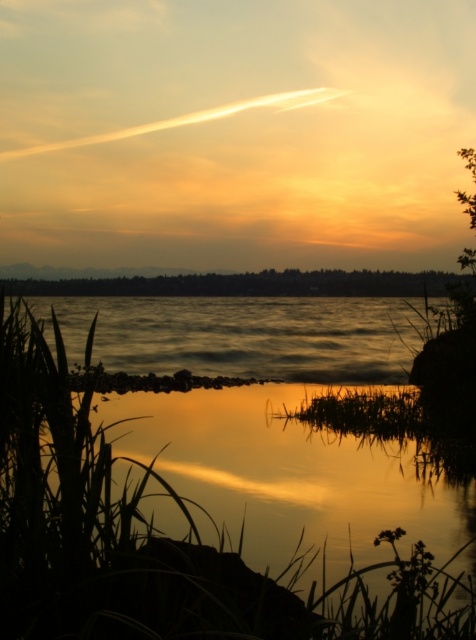
Based on the photo, you are an artist trying to paint the sunset scene. You notice two areas of reflective water in the image. Which area, the golden reflective water at lower center or the shiny reflective water at center, is narrower in width?

The golden reflective water at lower center is thinner than the shiny reflective water at center, so the golden reflective water at lower center is narrower in width.

In the scene shown: You are standing on the shore and want to take a photo of the golden reflective water at lower center and the shiny reflective water at center. Which one is located to the right of the other?

The golden reflective water at lower center is positioned on the right side of shiny reflective water at center.